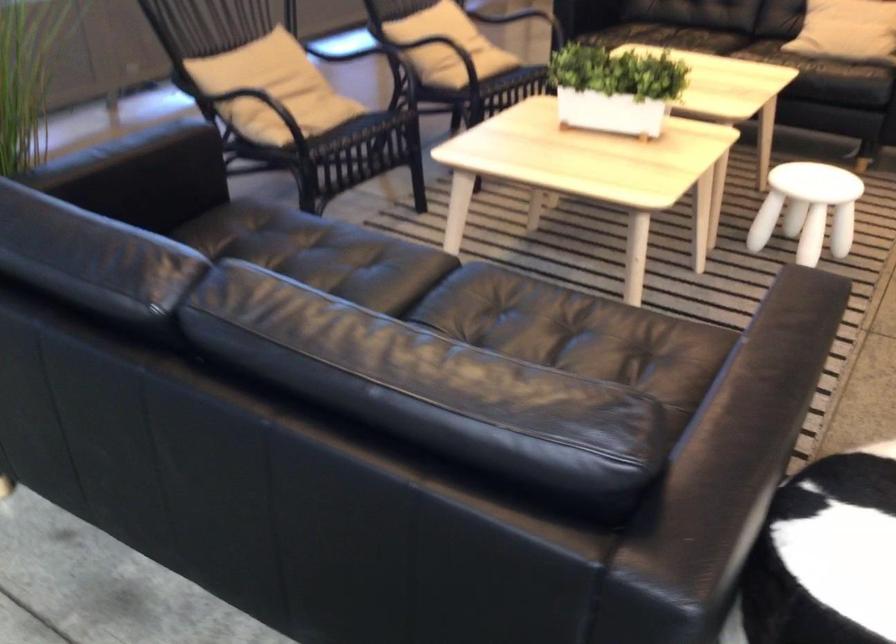
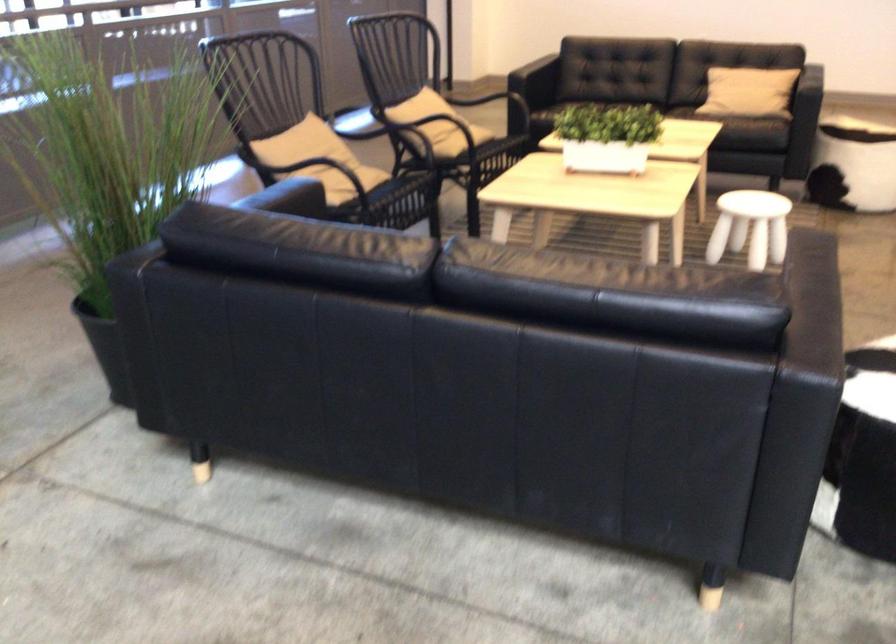
Where in the second image is the point corresponding to (x=608, y=88) from the first image?

(607, 137)